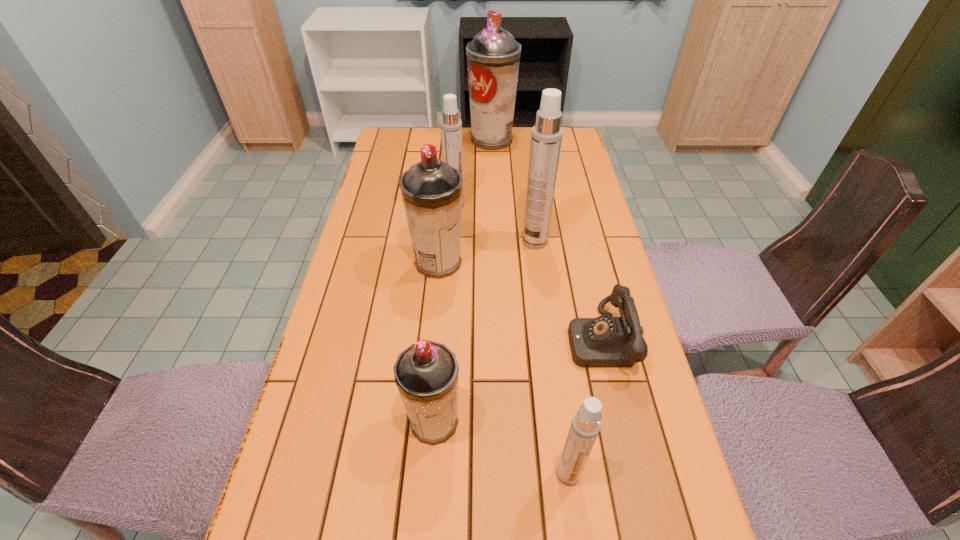
The image size is (960, 540). Identify the location of the biggest gray aerosol can. (493, 56).

Find the location of `the farthest object`. the farthest object is located at coordinates (493, 56).

Find the location of `the second nearest white aerosol can`. the second nearest white aerosol can is located at coordinates (546, 139).

This screenshot has width=960, height=540. Identify the location of the second farthest gray aerosol can. (431, 189).

I want to click on the second biggest white aerosol can, so click(451, 126).

Where is `the farthest white aerosol can`? The image size is (960, 540). the farthest white aerosol can is located at coordinates (451, 126).

The image size is (960, 540). In order to click on the nearest object in this screenshot , I will do `click(585, 425)`.

This screenshot has width=960, height=540. I want to click on the nearest aerosol can, so click(x=585, y=425).

At what (x,y) coordinates should I click in order to perform the action: click on the smallest gray aerosol can. Please return your answer as a coordinate pair (x, y). Looking at the image, I should click on (426, 373).

Identify the location of the sixth farthest object. (426, 373).